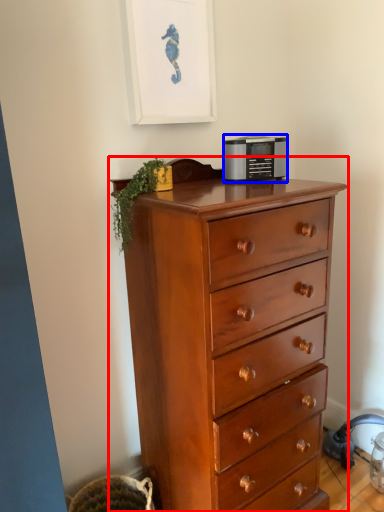
Question: Among these objects, which one is farthest to the camera, chest of drawers (highlighted by a red box) or appliance (highlighted by a blue box)?

Choices:
 (A) chest of drawers
 (B) appliance

Answer: (B)